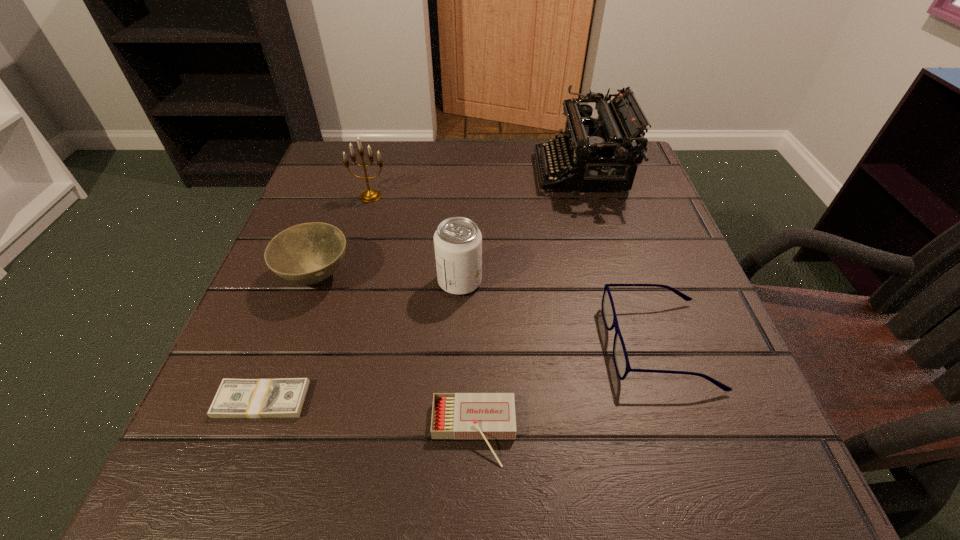
Locate an element on the screen. The image size is (960, 540). candelabrum located in the left edge section of the desktop is located at coordinates (370, 195).

At what (x,y) coordinates should I click in order to perform the action: click on bowl that is at the left edge. Please return your answer as a coordinate pair (x, y). Image resolution: width=960 pixels, height=540 pixels. Looking at the image, I should click on (308, 253).

Find the location of a particular element. The width and height of the screenshot is (960, 540). dollar present at the left edge is located at coordinates (236, 398).

Find the location of a particular element. This screenshot has width=960, height=540. typewriter that is positioned at the right edge is located at coordinates (600, 153).

Where is `spectacles present at the right edge`? Image resolution: width=960 pixels, height=540 pixels. spectacles present at the right edge is located at coordinates (621, 361).

You are a GUI agent. You are given a task and a screenshot of the screen. Output one action in this format:
    pyautogui.click(x=<x>, y=<y>)
    Task: Click on the object located at the far left corner
    This screenshot has width=960, height=540.
    Given the screenshot: What is the action you would take?
    pyautogui.click(x=370, y=195)

Find the location of a particular element. object positioned at the far right corner is located at coordinates (600, 153).

Identify the location of vacant region at the far edge. The width and height of the screenshot is (960, 540). (405, 168).

In the image, there is a desktop. In order to click on vacant space at the near edge in this screenshot , I will do `click(420, 464)`.

At what (x,y) coordinates should I click in order to perform the action: click on free space at the left edge. Please return your answer as a coordinate pair (x, y). Looking at the image, I should click on (323, 289).